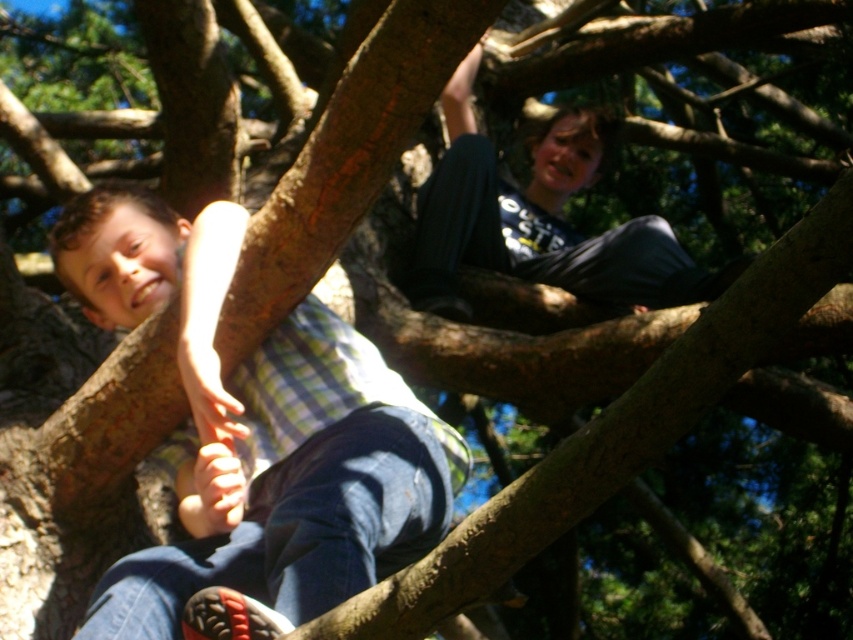
Question: Is checkered fabric shirt at center below dark gray cotton pants at upper center?

Choices:
 (A) no
 (B) yes

Answer: (B)

Question: Can you confirm if checkered fabric shirt at center is positioned to the right of dark gray cotton pants at upper center?

Choices:
 (A) no
 (B) yes

Answer: (A)

Question: Which point is closer to the camera?

Choices:
 (A) (412, 637)
 (B) (648, 241)
 (C) (155, 552)

Answer: (A)

Question: Can you confirm if checkered fabric shirt at center is positioned above brown rough tree branch at upper center?

Choices:
 (A) no
 (B) yes

Answer: (A)

Question: Which of the following is the closest to the observer?

Choices:
 (A) (555, 184)
 (B) (378, 577)
 (C) (809, 220)

Answer: (C)

Question: Which of the following is the closest to the observer?

Choices:
 (A) (357, 515)
 (B) (532, 260)
 (C) (482, 506)

Answer: (C)